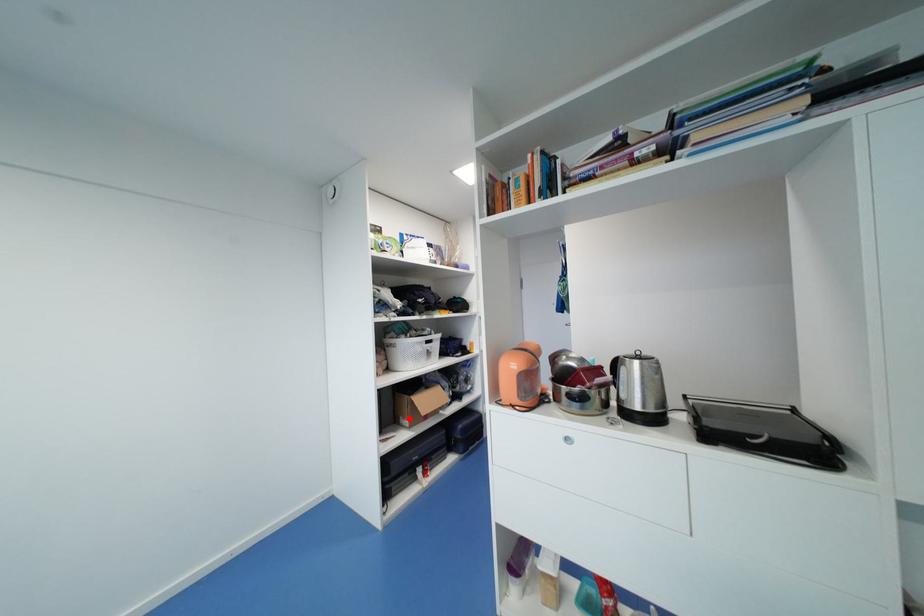
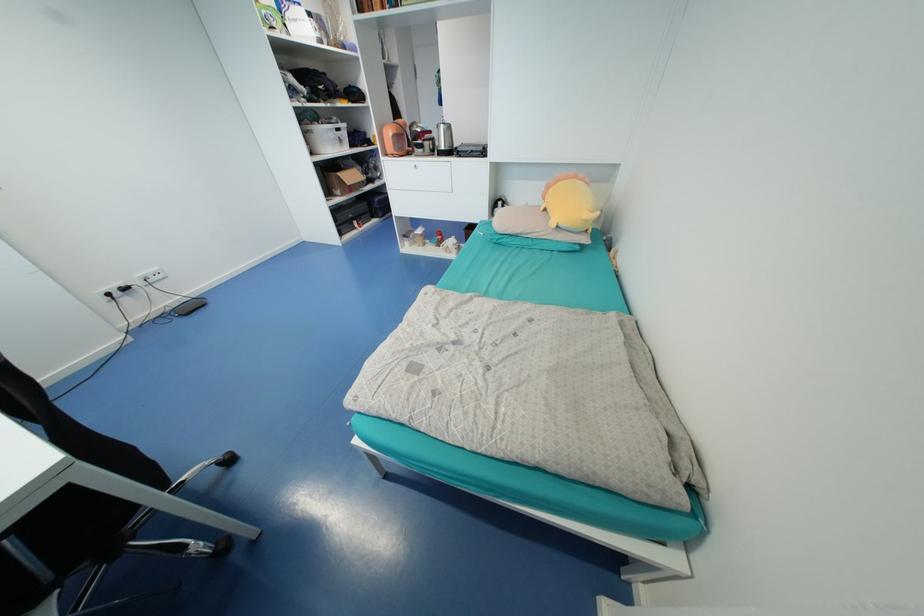
Locate, in the second image, the point that corresponds to the highlighted location in the first image.

(341, 190)